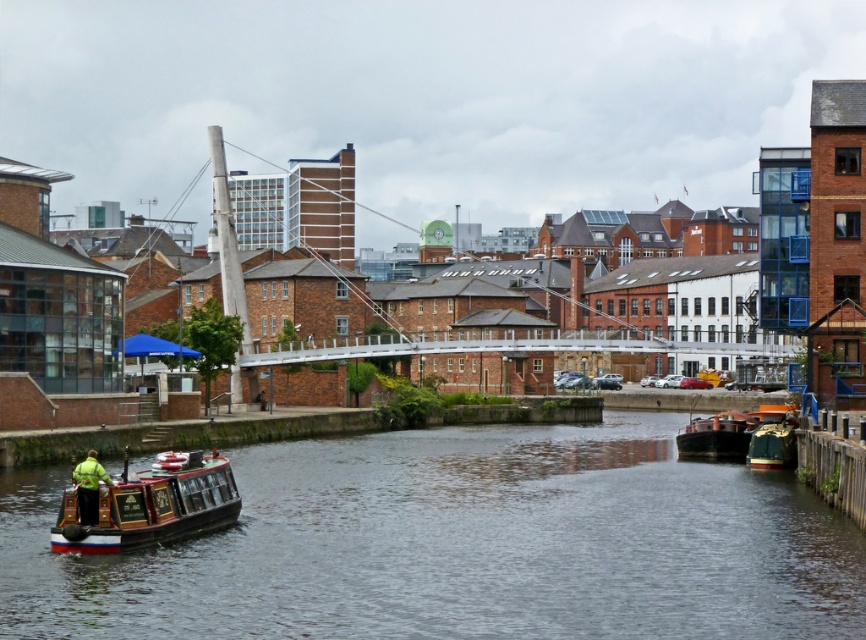
Is point (758, 448) positioned before point (81, 509)?

No, (758, 448) is behind (81, 509).

Which of these two, green fabric boat at lower right or green fabric jacket at lower left, stands taller?

With more height is green fabric jacket at lower left.

Is point (761, 458) more distant than point (86, 460)?

Yes, point (761, 458) is farther from viewer.

Locate an element on the screen. The height and width of the screenshot is (640, 866). green fabric boat at lower right is located at coordinates (772, 445).

Can you confirm if wooden polished boat at lower left is thinner than green fabric jacket at lower left?

No.

The height and width of the screenshot is (640, 866). What do you see at coordinates (147, 504) in the screenshot?
I see `wooden polished boat at lower left` at bounding box center [147, 504].

Measure the distance between wooden polished boat at lower left and camera.

wooden polished boat at lower left and camera are 59.71 meters apart.

Locate an element on the screen. wooden polished boat at lower left is located at coordinates (147, 504).

Which of these two, smooth dark water at center or wooden polished barge at lower right, stands taller?

With more height is wooden polished barge at lower right.

Does point (255, 509) lie behind point (719, 429)?

No, (255, 509) is in front of (719, 429).

Describe the element at coordinates (459, 545) in the screenshot. This screenshot has height=640, width=866. I see `smooth dark water at center` at that location.

At what (x,y) coordinates should I click in order to perform the action: click on smooth dark water at center. Please return your answer as a coordinate pair (x, y). This screenshot has height=640, width=866. Looking at the image, I should click on (459, 545).